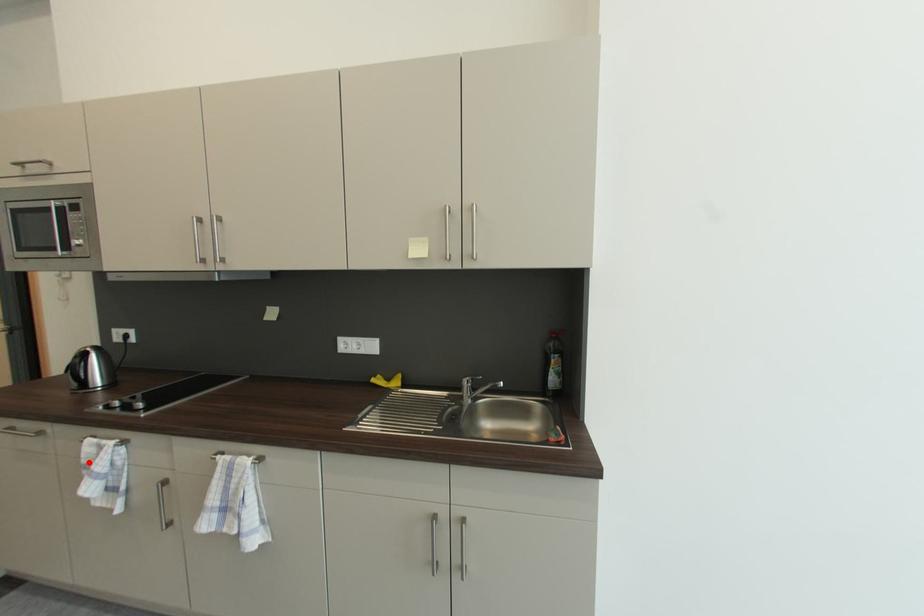
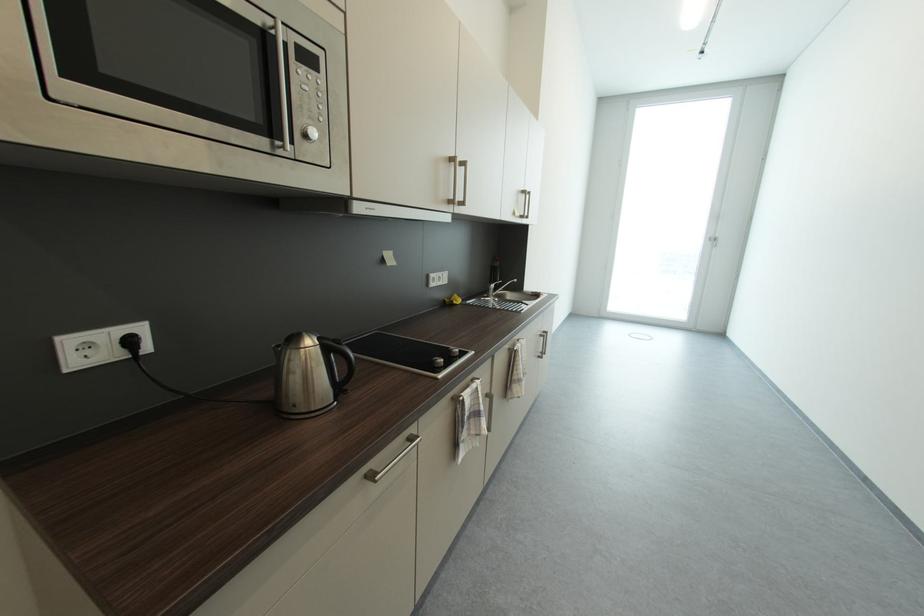
Question: I am providing you with two images of the same scene from different viewpoints. A red point is shown in image1. For the corresponding object point in image2, is it positioned nearer or farther from the camera?

Choices:
 (A) Nearer
 (B) Farther

Answer: (B)